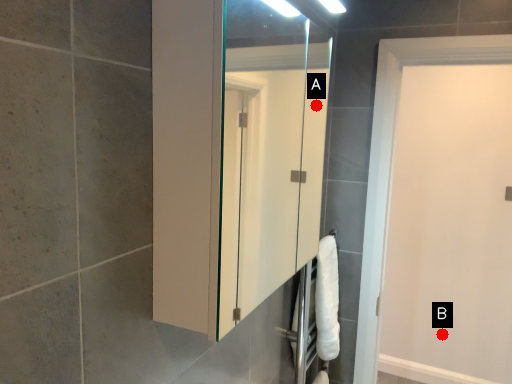
Question: Two points are circled on the image, labeled by A and B beside each circle. Which point is closer to the camera?

Choices:
 (A) A is closer
 (B) B is closer

Answer: (B)